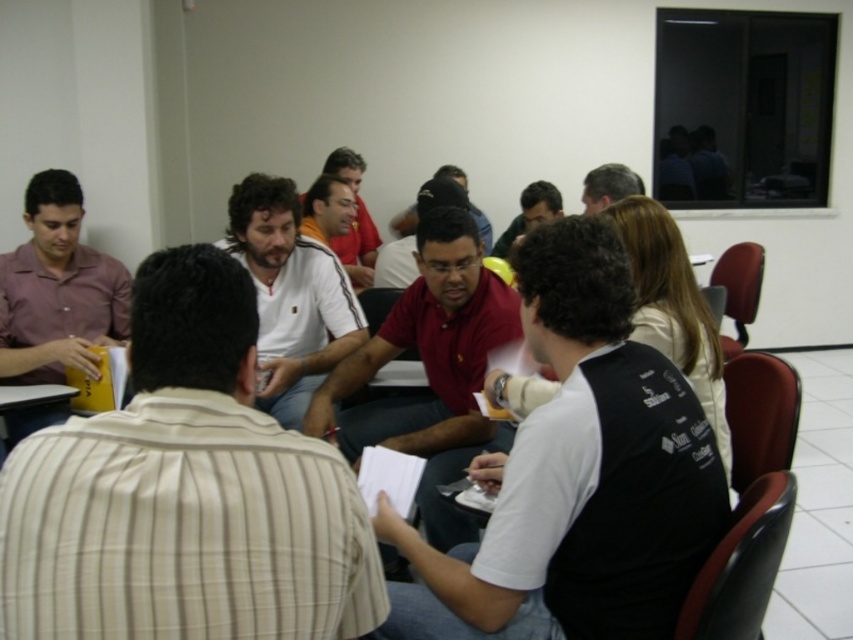
Question: Among these points, which one is nearest to the camera?

Choices:
 (A) (38, 340)
 (B) (396, 516)
 (C) (432, 250)
 (D) (329, 317)

Answer: (B)

Question: Estimate the real-world distances between objects in this image. Which object is closer to the matte black shirt at center?

Choices:
 (A) white shirt at center
 (B) striped cotton shirt at left

Answer: (A)

Question: Can you confirm if striped cotton shirt at left is positioned below white matte shirt at center?

Choices:
 (A) yes
 (B) no

Answer: (A)

Question: Can you confirm if striped cotton shirt at left is thinner than black matte shirt at upper center?

Choices:
 (A) yes
 (B) no

Answer: (B)

Question: Which point appears closest to the camera in this image?

Choices:
 (A) (325, 285)
 (B) (579, 381)
 (C) (337, 612)
 (D) (502, 285)

Answer: (C)

Question: Does white cotton shirt at center appear on the left side of matte red shirt at center?

Choices:
 (A) yes
 (B) no

Answer: (A)